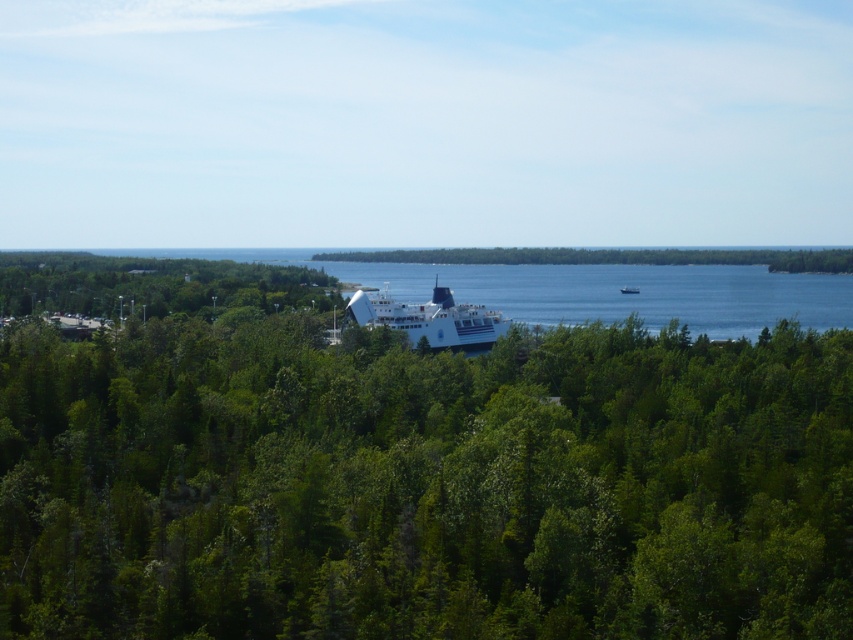
You are standing on the shore and looking at the green leafy trees at center and the blue water at center. Which object is closer to you?

The green leafy trees at center are closer to you since they are positioned in front of the blue water at center.

You are a photographer planning to capture a landscape photo that includes both the green leafy trees at center and the white glossy ship at center. Which object should you focus on first if you want to ensure both are in frame without moving the camera?

You should focus on the green leafy trees at center first because their width is larger than the white glossy ship at center, so they will occupy more space in the frame.